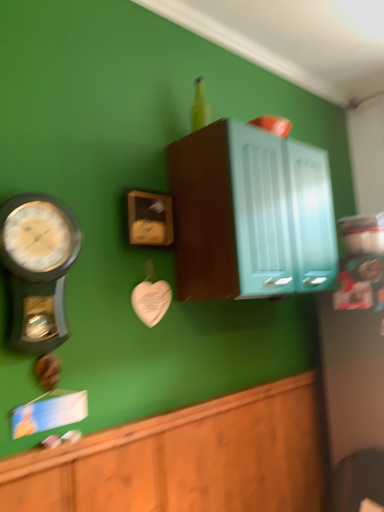
The width and height of the screenshot is (384, 512). What do you see at coordinates (38, 268) in the screenshot? I see `metallic silver wall clock at left` at bounding box center [38, 268].

This screenshot has height=512, width=384. Describe the element at coordinates (185, 460) in the screenshot. I see `wooden cabinet at lower center, positioned as the first cabinetry in bottom-to-top order` at that location.

What do you see at coordinates (149, 218) in the screenshot?
I see `wooden clock at center` at bounding box center [149, 218].

Where is `metallic silver wall clock at left`? The height and width of the screenshot is (512, 384). metallic silver wall clock at left is located at coordinates (38, 268).

Is point (37, 508) positioned after point (12, 307)?

No, (37, 508) is closer to viewer.

Is metallic silver wall clock at left at the back of wooden cabinet at lower center, positioned as the first cabinetry in bottom-to-top order?

That's not correct — wooden cabinet at lower center, positioned as the first cabinetry in bottom-to-top order, is not looking away from metallic silver wall clock at left.

From the image's perspective, is wooden cabinet at lower center, which ranks as the 2th cabinetry in top-to-bottom order, located above or below metallic silver wall clock at left?

Based on their image positions, wooden cabinet at lower center, which ranks as the 2th cabinetry in top-to-bottom order, is located beneath metallic silver wall clock at left.

Would you say wooden clock at center is inside or outside wooden cabinet at lower center, which ranks as the 2th cabinetry in top-to-bottom order?

wooden clock at center is outside wooden cabinet at lower center, which ranks as the 2th cabinetry in top-to-bottom order.

Is wooden clock at center to the left of wooden cabinet at lower center, which ranks as the 2th cabinetry in top-to-bottom order, from the viewer's perspective?

Yes.

Looking at the image, does wooden clock at center seem bigger or smaller compared to wooden cabinet at lower center, positioned as the first cabinetry in bottom-to-top order?

Clearly, wooden clock at center is smaller in size than wooden cabinet at lower center, positioned as the first cabinetry in bottom-to-top order.

Locate an element on the screen. Image resolution: width=384 pixels, height=512 pixels. cabinetry below the wooden clock at center (from the image's perspective) is located at coordinates (185, 460).

Looking at this image, considering the sizes of objects metallic silver wall clock at left and teal glossy cabinet at upper center, marked as the 1th cabinetry in a top-to-bottom arrangement, in the image provided, who is thinner, metallic silver wall clock at left or teal glossy cabinet at upper center, marked as the 1th cabinetry in a top-to-bottom arrangement,?

Thinner between the two is metallic silver wall clock at left.

Is metallic silver wall clock at left far away from teal glossy cabinet at upper center, marked as the 2th cabinetry in a bottom-to-top arrangement?

metallic silver wall clock at left is near teal glossy cabinet at upper center, marked as the 2th cabinetry in a bottom-to-top arrangement, not far away.

Is metallic silver wall clock at left looking in the opposite direction of teal glossy cabinet at upper center, marked as the 1th cabinetry in a top-to-bottom arrangement?

metallic silver wall clock at left is not turned away from teal glossy cabinet at upper center, marked as the 1th cabinetry in a top-to-bottom arrangement.

Is metallic silver wall clock at left further to camera compared to teal glossy cabinet at upper center, marked as the 1th cabinetry in a top-to-bottom arrangement?

No, metallic silver wall clock at left is closer to the camera.

Which object is positioned more to the right, wooden clock at center or metallic silver wall clock at left?

wooden clock at center.

From a real-world perspective, does wooden clock at center sit lower than metallic silver wall clock at left?

No, from a real-world perspective, wooden clock at center is not below metallic silver wall clock at left.

Is wooden clock at center facing towards metallic silver wall clock at left?

No, wooden clock at center is not aimed at metallic silver wall clock at left.

Where is `clock that appears above the metallic silver wall clock at left (from the image's perspective)`? Image resolution: width=384 pixels, height=512 pixels. clock that appears above the metallic silver wall clock at left (from the image's perspective) is located at coordinates (149, 218).

Is wooden clock at center oriented away from teal glossy cabinet at upper center, marked as the 1th cabinetry in a top-to-bottom arrangement?

No, teal glossy cabinet at upper center, marked as the 1th cabinetry in a top-to-bottom arrangement, is not at the back of wooden clock at center.

From the image's perspective, relative to teal glossy cabinet at upper center, marked as the 2th cabinetry in a bottom-to-top arrangement, is wooden clock at center above or below?

Clearly, from the image's perspective, wooden clock at center is below teal glossy cabinet at upper center, marked as the 2th cabinetry in a bottom-to-top arrangement.

Consider the image. Can you confirm if wooden clock at center is smaller than teal glossy cabinet at upper center, marked as the 1th cabinetry in a top-to-bottom arrangement?

Yes.

Can you confirm if teal glossy cabinet at upper center, marked as the 1th cabinetry in a top-to-bottom arrangement, is bigger than wooden cabinet at lower center, which ranks as the 2th cabinetry in top-to-bottom order?

Yes, teal glossy cabinet at upper center, marked as the 1th cabinetry in a top-to-bottom arrangement, is bigger than wooden cabinet at lower center, which ranks as the 2th cabinetry in top-to-bottom order.

Does point (280, 168) come closer to viewer compared to point (218, 414)?

Yes, it is in front of point (218, 414).

Consider the image. From a real-world perspective, between teal glossy cabinet at upper center, marked as the 1th cabinetry in a top-to-bottom arrangement, and wooden cabinet at lower center, which ranks as the 2th cabinetry in top-to-bottom order, who is vertically lower?

wooden cabinet at lower center, which ranks as the 2th cabinetry in top-to-bottom order, from a real-world perspective.

Choose the correct answer: Is wooden cabinet at lower center, which ranks as the 2th cabinetry in top-to-bottom order, inside teal glossy cabinet at upper center, marked as the 1th cabinetry in a top-to-bottom arrangement, or outside it?

wooden cabinet at lower center, which ranks as the 2th cabinetry in top-to-bottom order, exists outside the volume of teal glossy cabinet at upper center, marked as the 1th cabinetry in a top-to-bottom arrangement.

From a real-world perspective, is wooden cabinet at lower center, positioned as the first cabinetry in bottom-to-top order, under teal glossy cabinet at upper center, marked as the 2th cabinetry in a bottom-to-top arrangement?

Correct, in the physical world, wooden cabinet at lower center, positioned as the first cabinetry in bottom-to-top order, is lower than teal glossy cabinet at upper center, marked as the 2th cabinetry in a bottom-to-top arrangement.

Can you confirm if wooden cabinet at lower center, positioned as the first cabinetry in bottom-to-top order, is positioned to the right of teal glossy cabinet at upper center, marked as the 2th cabinetry in a bottom-to-top arrangement?

No.

Is wooden cabinet at lower center, positioned as the first cabinetry in bottom-to-top order, not close to teal glossy cabinet at upper center, marked as the 1th cabinetry in a top-to-bottom arrangement?

No, wooden cabinet at lower center, positioned as the first cabinetry in bottom-to-top order, is not far from teal glossy cabinet at upper center, marked as the 1th cabinetry in a top-to-bottom arrangement.

Which cabinetry is the 1st one when counting from the right side of the metallic silver wall clock at left? Please provide its 2D coordinates.

[(185, 460)]

Which cabinetry is the 2nd one when counting from the front of the wooden clock at center? Please provide its 2D coordinates.

[(185, 460)]

Estimate the real-world distances between objects in this image. Which object is further from wooden clock at center, metallic silver wall clock at left or teal glossy cabinet at upper center, marked as the 1th cabinetry in a top-to-bottom arrangement?

metallic silver wall clock at left is positioned further to the anchor wooden clock at center.

Which object lies further to the anchor point wooden clock at center, wooden cabinet at lower center, positioned as the first cabinetry in bottom-to-top order, or metallic silver wall clock at left?

wooden cabinet at lower center, positioned as the first cabinetry in bottom-to-top order, lies further to wooden clock at center than the other object.

When comparing their distances from wooden clock at center, does teal glossy cabinet at upper center, marked as the 1th cabinetry in a top-to-bottom arrangement, or wooden cabinet at lower center, positioned as the first cabinetry in bottom-to-top order, seem further?

wooden cabinet at lower center, positioned as the first cabinetry in bottom-to-top order, is positioned further to the anchor wooden clock at center.

From the image, which object appears to be nearer to metallic silver wall clock at left, teal glossy cabinet at upper center, marked as the 1th cabinetry in a top-to-bottom arrangement, or wooden clock at center?

The object closer to metallic silver wall clock at left is wooden clock at center.

Looking at the image, which one is located further to wooden cabinet at lower center, positioned as the first cabinetry in bottom-to-top order, teal glossy cabinet at upper center, marked as the 2th cabinetry in a bottom-to-top arrangement, or metallic silver wall clock at left?

teal glossy cabinet at upper center, marked as the 2th cabinetry in a bottom-to-top arrangement, lies further to wooden cabinet at lower center, positioned as the first cabinetry in bottom-to-top order, than the other object.

Which object lies further to the anchor point metallic silver wall clock at left, wooden cabinet at lower center, which ranks as the 2th cabinetry in top-to-bottom order, or teal glossy cabinet at upper center, marked as the 2th cabinetry in a bottom-to-top arrangement?

teal glossy cabinet at upper center, marked as the 2th cabinetry in a bottom-to-top arrangement.

Based on their spatial positions, is wooden clock at center or metallic silver wall clock at left closer to teal glossy cabinet at upper center, marked as the 1th cabinetry in a top-to-bottom arrangement?

wooden clock at center is closer to teal glossy cabinet at upper center, marked as the 1th cabinetry in a top-to-bottom arrangement.

Based on their spatial positions, is wooden clock at center or wooden cabinet at lower center, which ranks as the 2th cabinetry in top-to-bottom order, further from metallic silver wall clock at left?

wooden cabinet at lower center, which ranks as the 2th cabinetry in top-to-bottom order, is further to metallic silver wall clock at left.

Identify the location of clock between teal glossy cabinet at upper center, marked as the 1th cabinetry in a top-to-bottom arrangement, and wooden cabinet at lower center, positioned as the first cabinetry in bottom-to-top order, vertically. (149, 218).

Where is `wall clock between teal glossy cabinet at upper center, marked as the 1th cabinetry in a top-to-bottom arrangement, and wooden cabinet at lower center, positioned as the first cabinetry in bottom-to-top order, in the vertical direction`? The width and height of the screenshot is (384, 512). wall clock between teal glossy cabinet at upper center, marked as the 1th cabinetry in a top-to-bottom arrangement, and wooden cabinet at lower center, positioned as the first cabinetry in bottom-to-top order, in the vertical direction is located at coordinates (38, 268).

I want to click on wall clock between wooden clock at center and wooden cabinet at lower center, which ranks as the 2th cabinetry in top-to-bottom order, from top to bottom, so click(38, 268).

Locate an element on the screen. Image resolution: width=384 pixels, height=512 pixels. clock located between metallic silver wall clock at left and teal glossy cabinet at upper center, marked as the 1th cabinetry in a top-to-bottom arrangement, in the left-right direction is located at coordinates (149, 218).